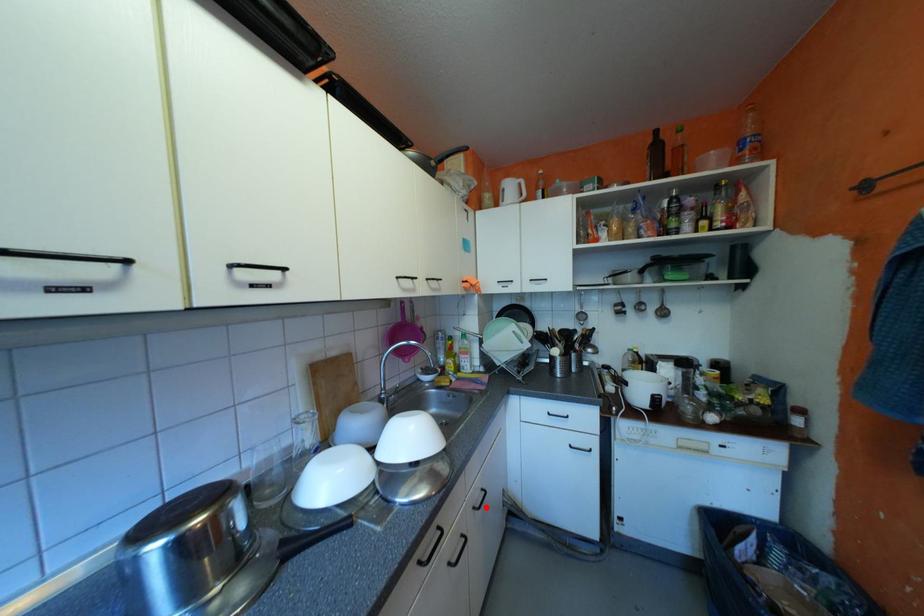
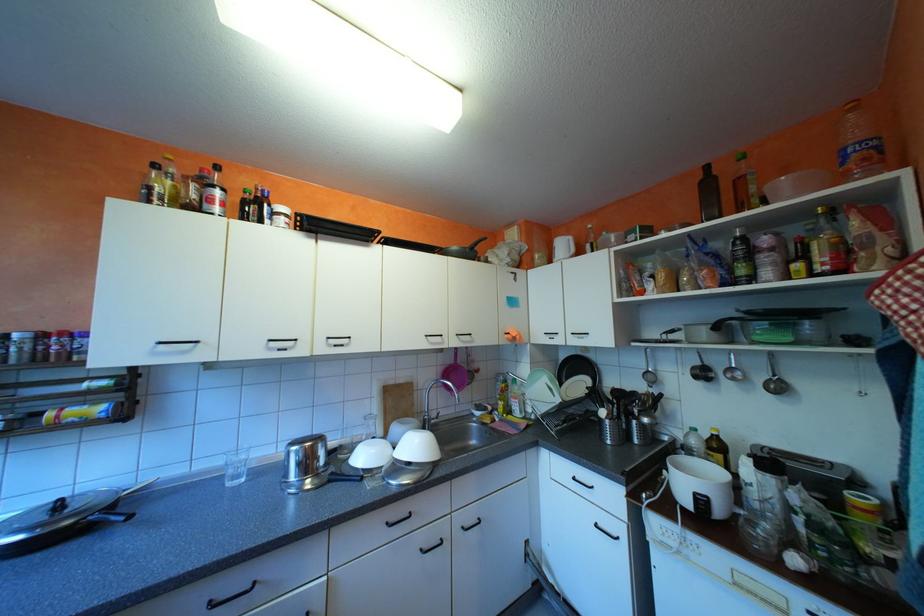
The point at the highlighted location is marked in the first image. Where is the corresponding point in the second image?

(475, 527)